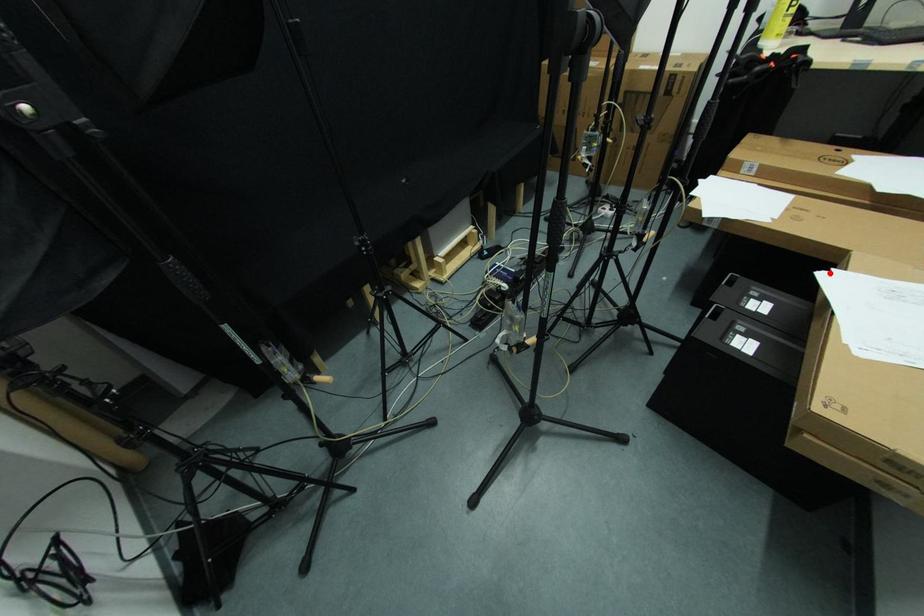
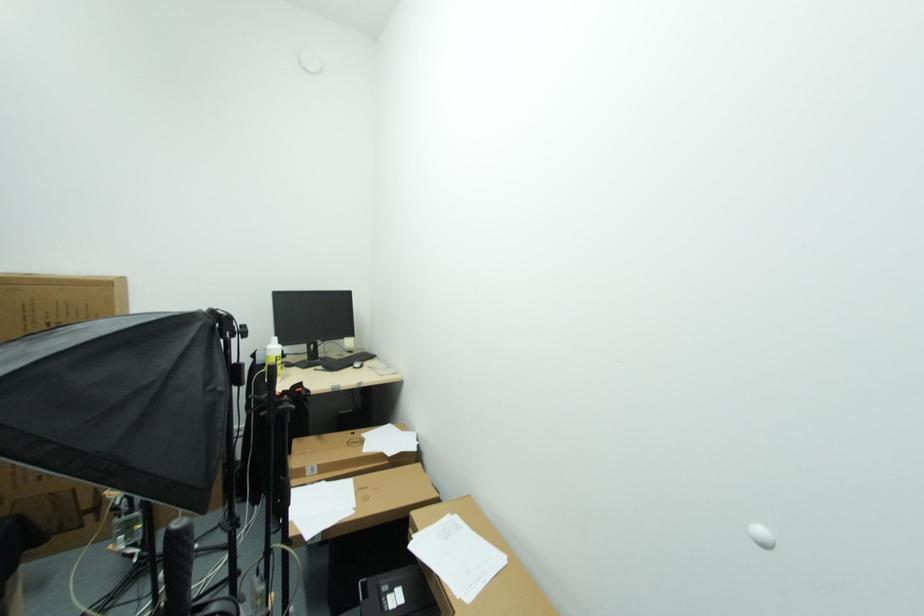
Locate, in the second image, the point that corresponds to the highlighted location in the first image.

(414, 541)